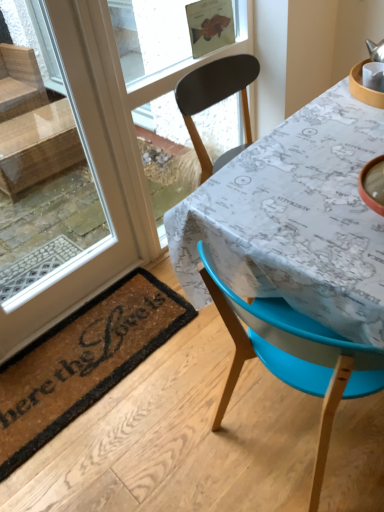
Locate an element on the screen. This screenshot has height=512, width=384. vacant area that lies between blue plastic chair at lower right and brown coir mat at lower left is located at coordinates (148, 435).